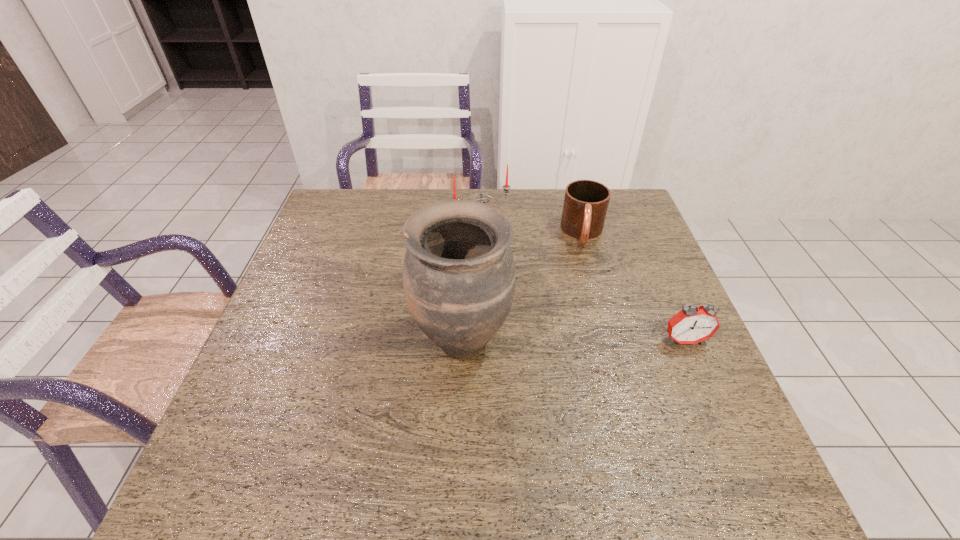
The image size is (960, 540). In the image, there is a desktop. What are the coordinates of `free space at the right edge` in the screenshot? It's located at (654, 240).

Image resolution: width=960 pixels, height=540 pixels. I want to click on blank space at the far left corner of the desktop, so click(328, 230).

Image resolution: width=960 pixels, height=540 pixels. Identify the location of free space at the near right corner. coord(709,433).

Locate an element on the screen. vacant area that lies between the third object from left to right and the rightmost object is located at coordinates (634, 287).

Locate an element on the screen. This screenshot has width=960, height=540. free space between the urn and the second object from right to left is located at coordinates (522, 286).

At what (x,y) coordinates should I click in order to perform the action: click on empty space between the rightmost object and the urn. Please return your answer as a coordinate pair (x, y). The height and width of the screenshot is (540, 960). Looking at the image, I should click on (573, 340).

At what (x,y) coordinates should I click in order to perform the action: click on unoccupied position between the mug and the tallest object. Please return your answer as a coordinate pair (x, y). The image size is (960, 540). Looking at the image, I should click on (522, 286).

This screenshot has width=960, height=540. What are the coordinates of `free space between the third object from left to right and the tallest object` in the screenshot? It's located at (522, 286).

This screenshot has width=960, height=540. I want to click on vacant region between the urn and the second object from right to left, so click(x=522, y=286).

Locate an element on the screen. This screenshot has width=960, height=540. free point between the third object from left to right and the alarm clock is located at coordinates (634, 287).